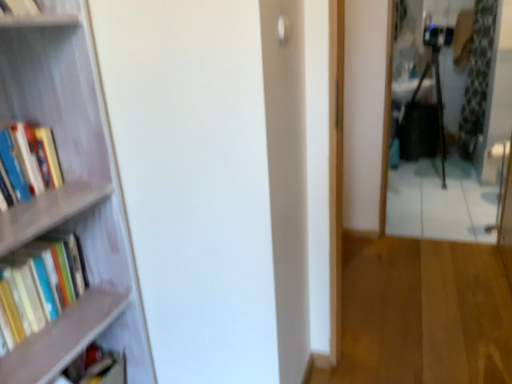
Where is `metallic reflective mirror at right`? metallic reflective mirror at right is located at coordinates (459, 168).

Locate an element on the screen. The width and height of the screenshot is (512, 384). wooden floor at center is located at coordinates (424, 312).

In order to face wooden floor at center, should I rotate leftwards or rightwards?

It's best to rotate right around 22.671 degrees.

Find the location of a particular element. green floral fabric curtain at right is located at coordinates (477, 78).

Image resolution: width=512 pixels, height=384 pixels. I want to click on wooden bookshelf at left, so click(x=69, y=200).

Image resolution: width=512 pixels, height=384 pixels. In order to click on hardcover books at left, which is the 2th book from bottom to top in this screenshot , I will do `click(41, 283)`.

Is there a large distance between wooden bookshelf at left and green floral fabric curtain at right?

That's right, there is a large distance between wooden bookshelf at left and green floral fabric curtain at right.

Between wooden bookshelf at left and green floral fabric curtain at right, which one has less height?

wooden bookshelf at left is shorter.

Can we say wooden bookshelf at left lies outside green floral fabric curtain at right?

Absolutely, wooden bookshelf at left is external to green floral fabric curtain at right.

From a real-world perspective, is wooden bookshelf at left beneath green floral fabric curtain at right?

Yes.

Who is bigger, green floral fabric curtain at right or wooden bookshelf at left?

wooden bookshelf at left is bigger.

Which object is positioned more to the right, green floral fabric curtain at right or wooden bookshelf at left?

green floral fabric curtain at right is more to the right.

Is green floral fabric curtain at right positioned with its back to wooden bookshelf at left?

No, green floral fabric curtain at right's orientation is not away from wooden bookshelf at left.

Consider the image. From a real-world perspective, is green floral fabric curtain at right on top of wooden bookshelf at left?

Yes.

From a real-world perspective, between green floral fabric curtain at right and hardcover books at left, the 3th book in the bottom-to-top sequence, who is vertically higher?

In real-world perspective, hardcover books at left, the 3th book in the bottom-to-top sequence, is above.

Based on the photo, is green floral fabric curtain at right positioned before hardcover books at left, the 3th book in the bottom-to-top sequence?

No, the depth of green floral fabric curtain at right is greater than that of hardcover books at left, the 3th book in the bottom-to-top sequence.

Does green floral fabric curtain at right have a greater width compared to hardcover books at left, which ranks as the first book in top-to-bottom order?

In fact, green floral fabric curtain at right might be narrower than hardcover books at left, which ranks as the first book in top-to-bottom order.

Is green floral fabric curtain at right facing towards hardcover books at left, the 3th book in the bottom-to-top sequence?

No.

From the image's perspective, is hardcover books at left, which is the 2th book from bottom to top, over metallic reflective mirror at right?

No, from the image's perspective, hardcover books at left, which is the 2th book from bottom to top, is not on top of metallic reflective mirror at right.

Considering the sizes of objects hardcover books at left, which is the 2th book from bottom to top, and metallic reflective mirror at right in the image provided, who is bigger, hardcover books at left, which is the 2th book from bottom to top, or metallic reflective mirror at right?

metallic reflective mirror at right is bigger.

Is hardcover books at left, which is the 2th book from bottom to top, to the left of metallic reflective mirror at right from the viewer's perspective?

Correct, you'll find hardcover books at left, which is the 2th book from bottom to top, to the left of metallic reflective mirror at right.

Does hardcover books at left, which ranks as the first book in top-to-bottom order, have a smaller size compared to hardcover books at left, which is the 2th book from bottom to top?

Yes, hardcover books at left, which ranks as the first book in top-to-bottom order, is smaller than hardcover books at left, which is the 2th book from bottom to top.

Is hardcover books at left, the 3th book in the bottom-to-top sequence, wider or thinner than hardcover books at left, which ranks as the 2th book in top-to-bottom order?

Clearly, hardcover books at left, the 3th book in the bottom-to-top sequence, has more width compared to hardcover books at left, which ranks as the 2th book in top-to-bottom order.

Is hardcover books at left, the 3th book in the bottom-to-top sequence, turned away from hardcover books at left, which ranks as the 2th book in top-to-bottom order?

No, hardcover books at left, the 3th book in the bottom-to-top sequence, is not facing away from hardcover books at left, which ranks as the 2th book in top-to-bottom order.

How many degrees apart are the facing directions of hardcover books at left, the 3th book in the bottom-to-top sequence, and hardcover books at left, which ranks as the 2th book in top-to-bottom order?

The angular difference between hardcover books at left, the 3th book in the bottom-to-top sequence, and hardcover books at left, which ranks as the 2th book in top-to-bottom order, is 0.49 degrees.

Which object is wider, metallic reflective mirror at right or hardcover books at left, which ranks as the 2th book in top-to-bottom order?

Wider between the two is hardcover books at left, which ranks as the 2th book in top-to-bottom order.

Does metallic reflective mirror at right come behind hardcover books at left, which is the 2th book from bottom to top?

Yes, metallic reflective mirror at right is further from the viewer.

Where is `the 2nd book in front of the metallic reflective mirror at right`? The height and width of the screenshot is (384, 512). the 2nd book in front of the metallic reflective mirror at right is located at coordinates (41, 283).

Is metallic reflective mirror at right bigger or smaller than hardcover books at left, which ranks as the 2th book in top-to-bottom order?

Considering their sizes, metallic reflective mirror at right takes up more space than hardcover books at left, which ranks as the 2th book in top-to-bottom order.

From the image's perspective, which is above, wooden bookshelf at left or wooden floor at center?

wooden bookshelf at left is shown above in the image.

Is wooden bookshelf at left facing towards wooden floor at center?

No.

Choose the correct answer: Is wooden bookshelf at left inside wooden floor at center or outside it?

wooden bookshelf at left cannot be found inside wooden floor at center.

Is wooden bookshelf at left shorter than wooden floor at center?

Incorrect, the height of wooden bookshelf at left does not fall short of that of wooden floor at center.

Image resolution: width=512 pixels, height=384 pixels. Find the location of `bookcase lying on the left of green floral fabric curtain at right`. bookcase lying on the left of green floral fabric curtain at right is located at coordinates (69, 200).

Locate an element on the screen. bookcase that is in front of the green floral fabric curtain at right is located at coordinates (69, 200).

Looking at the image, which one is located further to wooden floor at center, metallic reflective mirror at right or green floral fabric curtain at right?

green floral fabric curtain at right.

When comparing their distances from wooden bookshelf at left, does hardcover books at left, which ranks as the 2th book in top-to-bottom order, or wooden floor at center seem further?

Among the two, wooden floor at center is located further to wooden bookshelf at left.

Based on their spatial positions, is wooden bookshelf at left or green floral fabric curtain at right closer to hardcover books at left, the 3th book in the bottom-to-top sequence?

Among the two, wooden bookshelf at left is located nearer to hardcover books at left, the 3th book in the bottom-to-top sequence.

Based on their spatial positions, is wooden bookshelf at left or hardcover books at left, the 3th book in the bottom-to-top sequence, closer to matte black book at lower left, which is the third book from top to bottom?

Among the two, wooden bookshelf at left is located nearer to matte black book at lower left, which is the third book from top to bottom.

Estimate the real-world distances between objects in this image. Which object is closer to hardcover books at left, which ranks as the 2th book in top-to-bottom order, metallic reflective mirror at right or wooden bookshelf at left?

wooden bookshelf at left.

Considering their positions, is wooden bookshelf at left positioned further to green floral fabric curtain at right than hardcover books at left, which ranks as the 2th book in top-to-bottom order?

hardcover books at left, which ranks as the 2th book in top-to-bottom order, is positioned further to the anchor green floral fabric curtain at right.

Considering their positions, is wooden floor at center positioned closer to metallic reflective mirror at right than green floral fabric curtain at right?

green floral fabric curtain at right lies closer to metallic reflective mirror at right than the other object.

When comparing their distances from matte black book at lower left, acting as the 1th book starting from the bottom, does hardcover books at left, which is the 2th book from bottom to top, or green floral fabric curtain at right seem further?

Based on the image, green floral fabric curtain at right appears to be further to matte black book at lower left, acting as the 1th book starting from the bottom.

Image resolution: width=512 pixels, height=384 pixels. Identify the location of bookcase between hardcover books at left, which ranks as the first book in top-to-bottom order, and green floral fabric curtain at right from left to right. (69, 200).

What are the coordinates of `mirror located between wooden floor at center and green floral fabric curtain at right in the depth direction` in the screenshot? It's located at (459, 168).

The image size is (512, 384). Find the location of `mirror between wooden bookshelf at left and green floral fabric curtain at right along the z-axis`. mirror between wooden bookshelf at left and green floral fabric curtain at right along the z-axis is located at coordinates (459, 168).

At what (x,y) coordinates should I click in order to perform the action: click on bookstore between matte black book at lower left, acting as the 1th book starting from the bottom, and green floral fabric curtain at right from left to right. Please return your answer as a coordinate pair (x, y). The image size is (512, 384). Looking at the image, I should click on (424, 312).